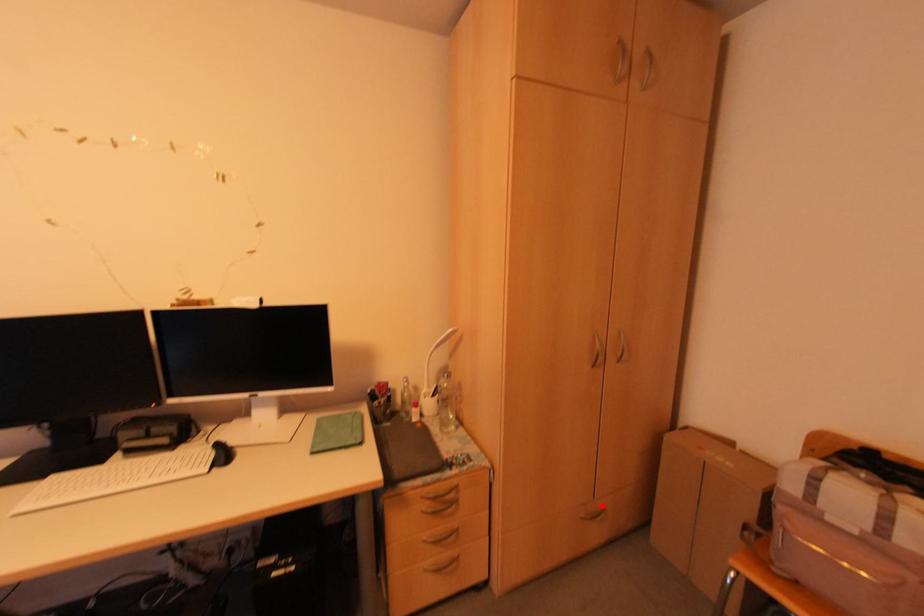
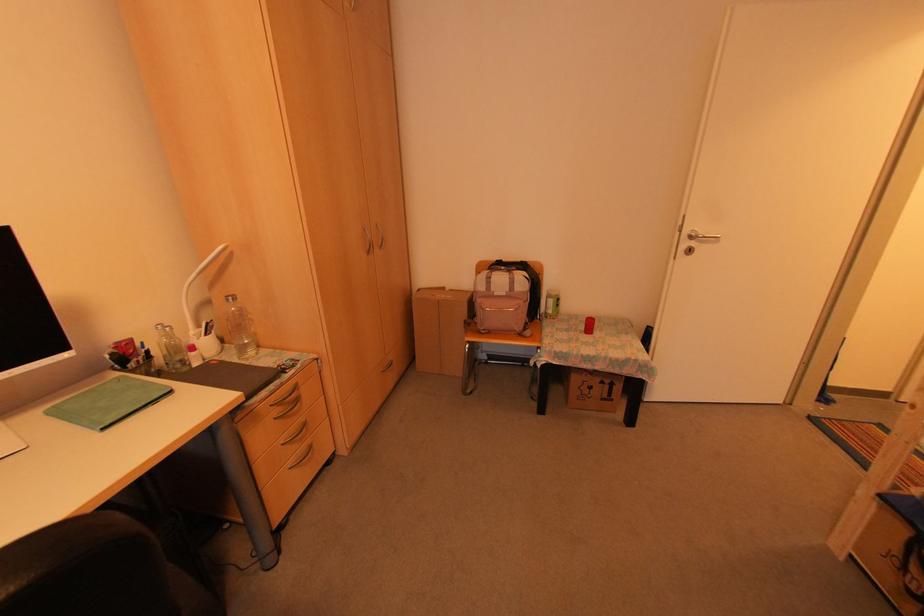
Find the pixel in the second image that matches the highlighted location in the first image.

(388, 359)